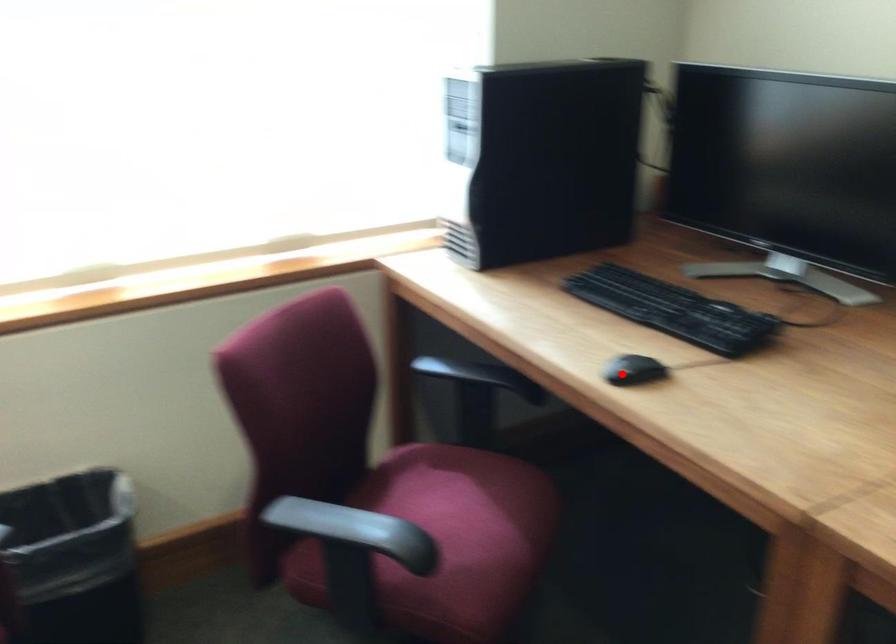
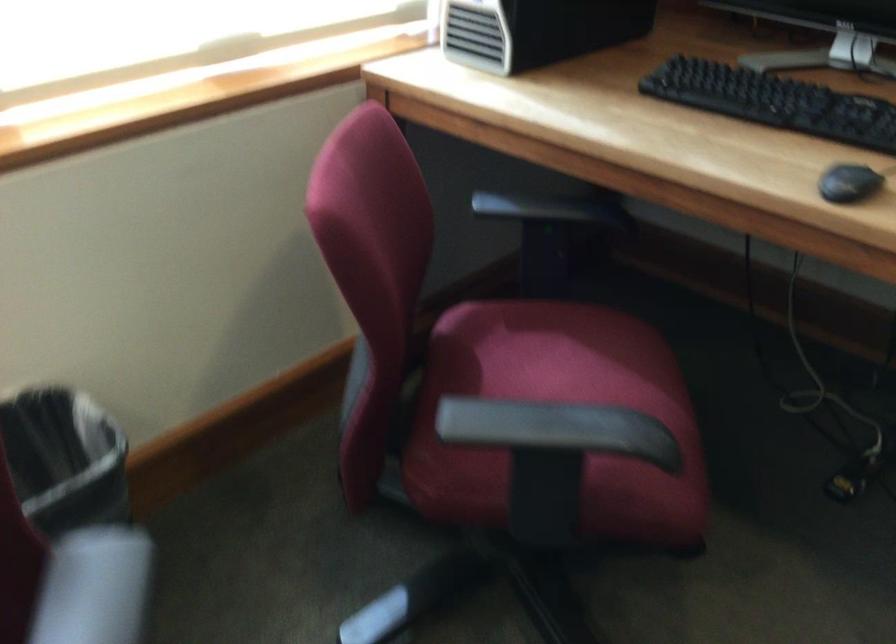
In the second image, find the point that corresponds to the highlighted location in the first image.

(848, 183)